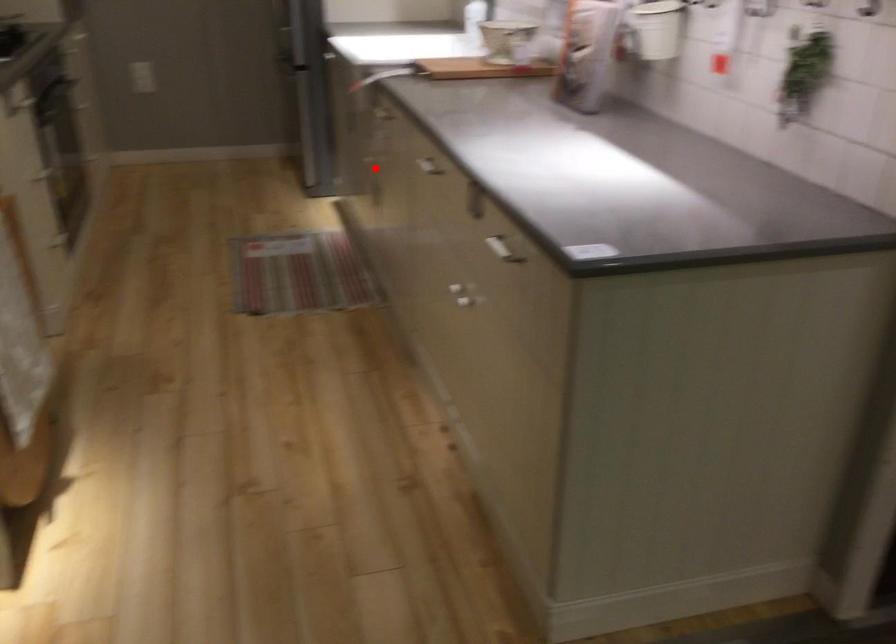
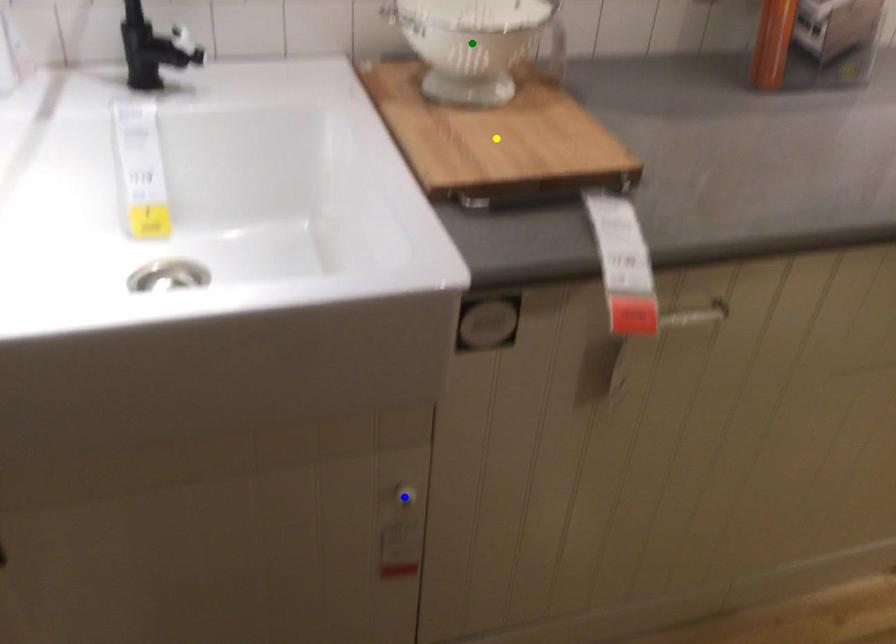
Question: I am providing you with two images of the same scene from different viewpoints. A red point is marked on the first image. You are given multiple points on the second image. Which point in image 2 is actually the same real-world point as the red point in image 1?

Choices:
 (A) green point
 (B) blue point
 (C) yellow point

Answer: (B)